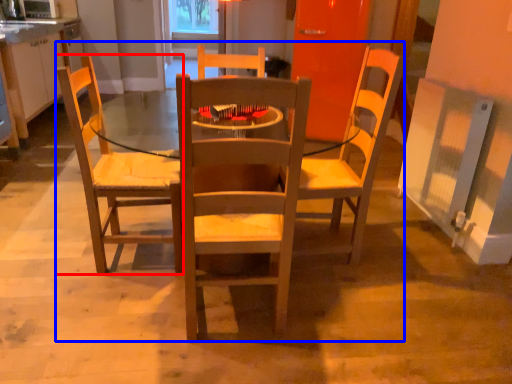
Question: Which point is closer to the camera, chair (highlighted by a red box) or trio (highlighted by a blue box)?

Choices:
 (A) chair
 (B) trio

Answer: (B)